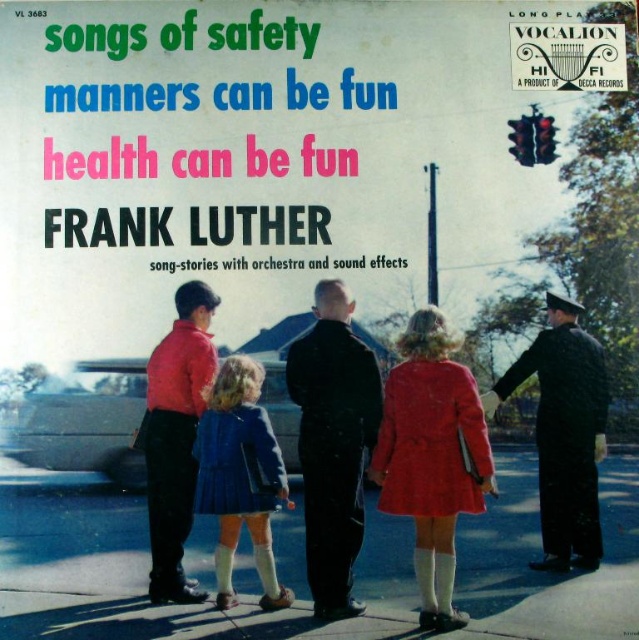
Which is above, blue woolen coat at center or black uniform at right?

Positioned higher is black uniform at right.

Measure the distance between point (x=210, y=348) and camera.

Point (x=210, y=348) is 35.81 feet from camera.

The width and height of the screenshot is (639, 640). Identify the location of blue woolen coat at center. (385, 445).

Who is more distant from viewer, (x=440, y=444) or (x=245, y=500)?

Positioned behind is point (x=440, y=444).

Does blue woolen coat at center have a lesser width compared to blue pleated skirt at center?

No.

Locate an element on the screen. blue woolen coat at center is located at coordinates (385, 445).

Where is `blue woolen coat at center`? This screenshot has width=639, height=640. blue woolen coat at center is located at coordinates (385, 445).

Who is taller, black uniform at right or blue pleated skirt at center?

With more height is black uniform at right.

Is black uniform at right wider than blue pleated skirt at center?

Indeed, black uniform at right has a greater width compared to blue pleated skirt at center.

Image resolution: width=639 pixels, height=640 pixels. Identify the location of black uniform at right. (564, 433).